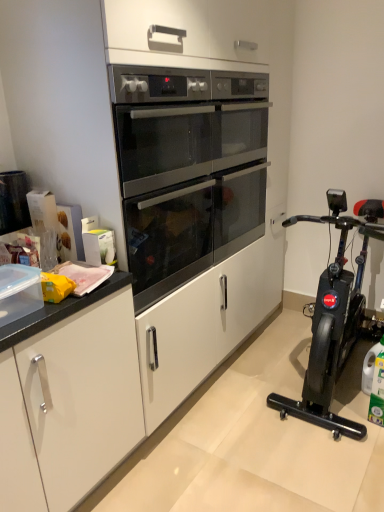
Question: From a real-world perspective, is satin black oven at center above or below black plastic exercise bike at right?

Choices:
 (A) below
 (B) above

Answer: (B)

Question: Is satin black oven at center inside or outside of black plastic exercise bike at right?

Choices:
 (A) outside
 (B) inside

Answer: (A)

Question: Would you say satin black oven at center is to the left or to the right of black plastic exercise bike at right in the picture?

Choices:
 (A) right
 (B) left

Answer: (B)

Question: Is black plastic exercise bike at right wider or thinner than satin black oven at center?

Choices:
 (A) thin
 (B) wide

Answer: (B)

Question: From the image's perspective, is black plastic exercise bike at right positioned above or below satin black oven at center?

Choices:
 (A) below
 (B) above

Answer: (A)

Question: Is point (316, 222) positioned closer to the camera than point (140, 178)?

Choices:
 (A) closer
 (B) farther

Answer: (B)

Question: Is black plastic exercise bike at right inside the boundaries of satin black oven at center, or outside?

Choices:
 (A) outside
 (B) inside

Answer: (A)